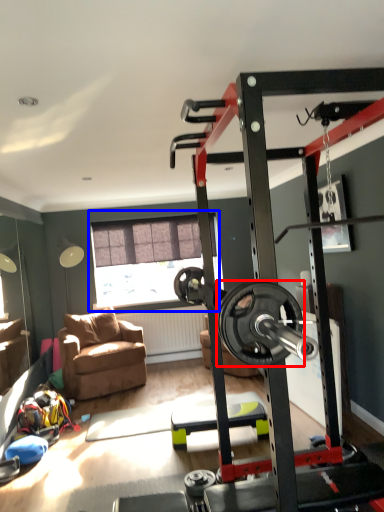
Question: Which object is closer to the camera taking this photo, wheel (highlighted by a red box) or window (highlighted by a blue box)?

Choices:
 (A) wheel
 (B) window

Answer: (A)